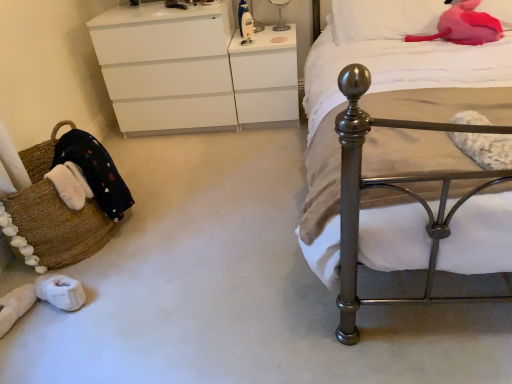
Where is `free space between white glossy changing table at upper center and brown woven basket at lower left`? free space between white glossy changing table at upper center and brown woven basket at lower left is located at coordinates (196, 174).